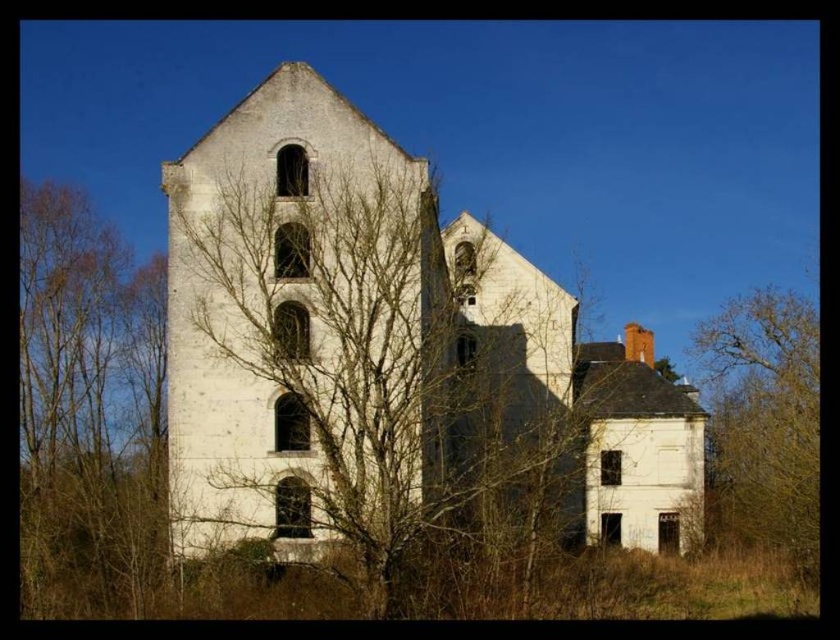
Question: Does bare branches at left have a lesser width compared to yellow-green leafy tree at right?

Choices:
 (A) yes
 (B) no

Answer: (B)

Question: Does bare branches at left appear over yellow-green leafy tree at right?

Choices:
 (A) yes
 (B) no

Answer: (A)

Question: Which point is closer to the camera?

Choices:
 (A) yellow-green leafy tree at right
 (B) bare branches at left

Answer: (B)

Question: Is white stone church at center below yellow-green leafy tree at right?

Choices:
 (A) no
 (B) yes

Answer: (A)

Question: Considering the real-world distances, which object is closest to the bare branches at left?

Choices:
 (A) yellow-green leafy tree at right
 (B) white stone church at center

Answer: (B)

Question: Which of these objects is positioned farthest from the bare branches at left?

Choices:
 (A) yellow-green leafy tree at right
 (B) white stone church at center

Answer: (A)